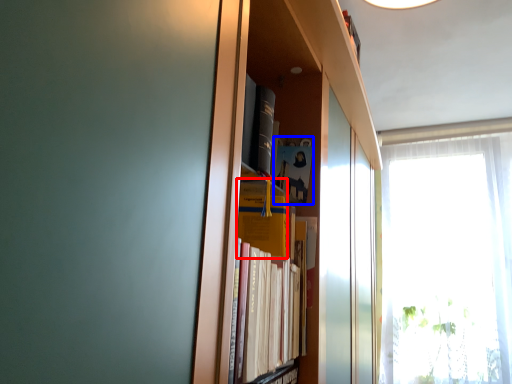
Question: Which point is further to the camera, paperback book (highlighted by a red box) or paperback book (highlighted by a blue box)?

Choices:
 (A) paperback book
 (B) paperback book

Answer: (B)